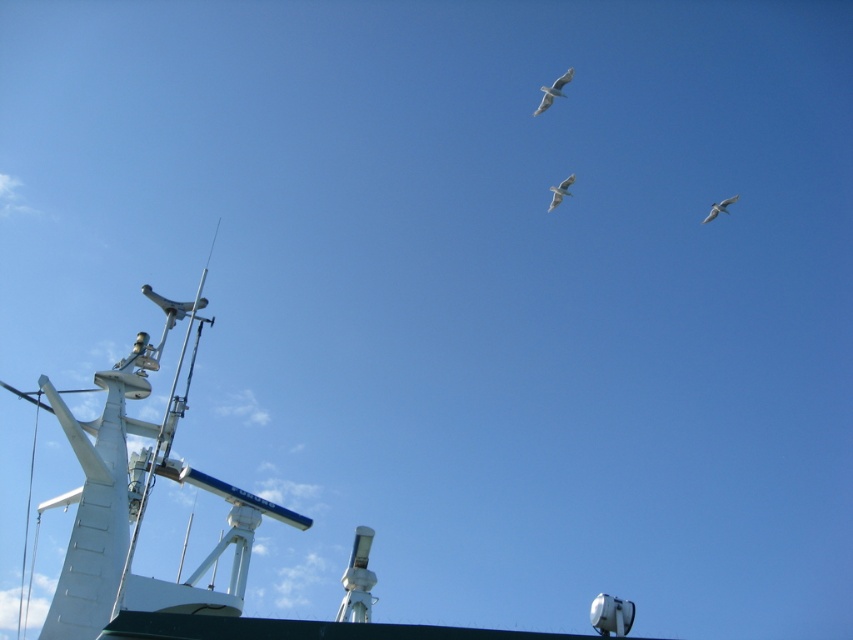
Question: Considering the real-world distances, which object is farthest from the white matte radar at upper left?

Choices:
 (A) white feathered bird at upper right
 (B) white feathered bird at upper center
 (C) white feathered bird at center

Answer: (A)

Question: Is white feathered bird at center wider than white feathered bird at upper right?

Choices:
 (A) yes
 (B) no

Answer: (B)

Question: Does white matte radar at upper left appear on the right side of white feathered bird at center?

Choices:
 (A) no
 (B) yes

Answer: (A)

Question: Which of the following is the farthest from the observer?

Choices:
 (A) (61, 589)
 (B) (570, 182)
 (C) (733, 198)
 (D) (541, 109)

Answer: (B)

Question: Which point appears closest to the camera in this image?

Choices:
 (A) (721, 202)
 (B) (561, 93)
 (C) (105, 579)

Answer: (C)

Question: Can you confirm if white feathered bird at upper center is wider than white feathered bird at upper right?

Choices:
 (A) no
 (B) yes

Answer: (A)